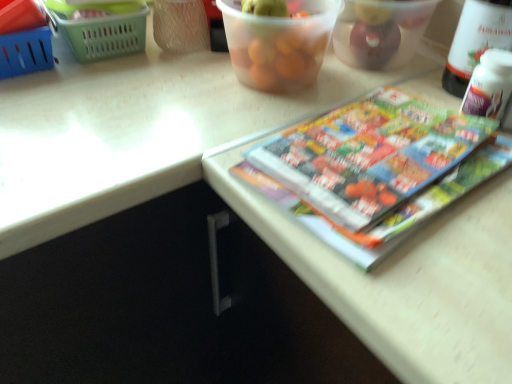
Where is `empty space that is ontop of multicolored glossy book at upper right (from a real-world perspective)`? Image resolution: width=512 pixels, height=384 pixels. empty space that is ontop of multicolored glossy book at upper right (from a real-world perspective) is located at coordinates (388, 149).